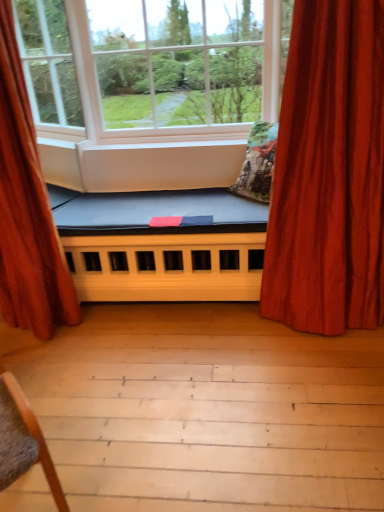
Question: Does point (309, 9) appear closer or farther from the camera than point (31, 234)?

Choices:
 (A) farther
 (B) closer

Answer: (B)

Question: Considering the positions of velvet red curtain at right, arranged as the 2th curtain when viewed from the left, and velvet red curtain at left, which is the 2th curtain in right-to-left order, in the image, is velvet red curtain at right, arranged as the 2th curtain when viewed from the left, taller or shorter than velvet red curtain at left, which is the 2th curtain in right-to-left order,?

Choices:
 (A) short
 (B) tall

Answer: (A)

Question: Which is nearer to the white matte window at center, positioned as the first window in right-to-left order?

Choices:
 (A) textured floral pillow at center
 (B) blue fabric futon at center
 (C) velvet red curtain at right, the 1th curtain when ordered from right to left
 (D) velvet red curtain at left, the 1th curtain in the left-to-right sequence
 (E) clear glass window at upper center, arranged as the 1th window when viewed from the left

Answer: (E)

Question: Based on their relative distances, which object is nearer to the blue fabric futon at center?

Choices:
 (A) textured floral pillow at center
 (B) white matte window at center, positioned as the first window in right-to-left order
 (C) velvet red curtain at left, which is the 2th curtain in right-to-left order
 (D) velvet red curtain at right, arranged as the 2th curtain when viewed from the left
 (E) clear glass window at upper center, which appears as the 2th window when viewed from the right

Answer: (C)